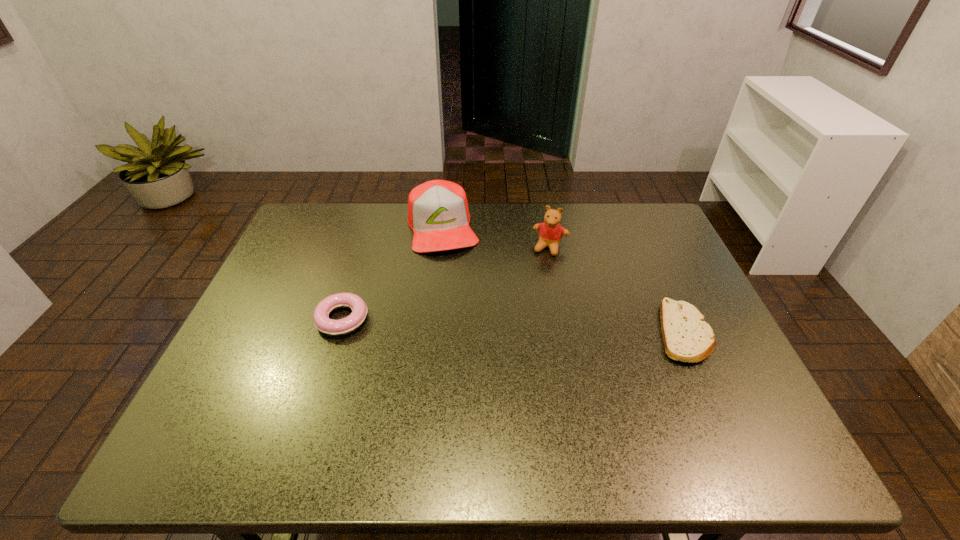
Image resolution: width=960 pixels, height=540 pixels. What are the coordinates of `the third tallest object` in the screenshot? It's located at (322, 322).

Identify the location of doughnut. Image resolution: width=960 pixels, height=540 pixels. (322, 322).

I want to click on pita bread, so click(687, 337).

Locate an element on the screen. Image resolution: width=960 pixels, height=540 pixels. the rightmost object is located at coordinates (687, 337).

Find the location of a particular element. baseball cap is located at coordinates (438, 213).

The image size is (960, 540). What are the coordinates of `teddy bear` in the screenshot? It's located at (550, 232).

Find the location of `vacant space located on the back of the second shortest object`. vacant space located on the back of the second shortest object is located at coordinates (371, 229).

This screenshot has width=960, height=540. I want to click on free space located 0.210m on the left of the rightmost object, so click(570, 333).

Identify the location of vacant space situated on the front-facing side of the third object from right to left. (477, 363).

Identify the location of vacant space located 0.120m on the front-facing side of the third object from right to left. (455, 282).